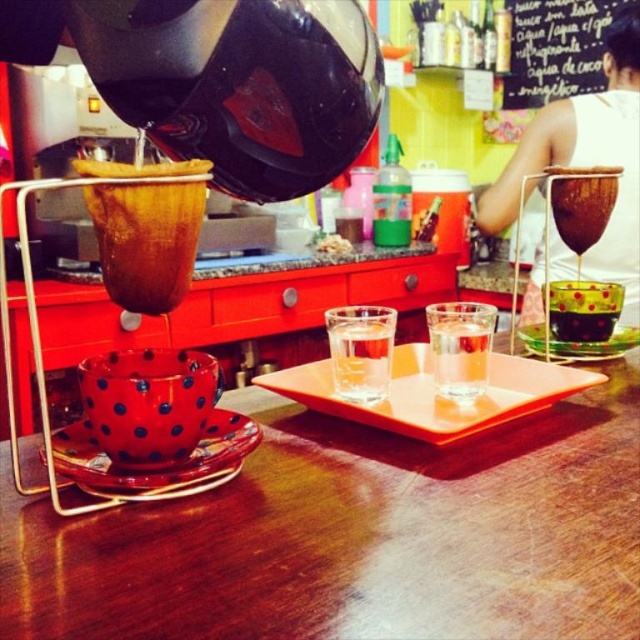
Can you confirm if wooden table at center is positioned above black chalkboard at upper center?

Incorrect, wooden table at center is not positioned above black chalkboard at upper center.

Is point (349, 451) closer to camera compared to point (593, 77)?

Yes, point (349, 451) is in front of point (593, 77).

This screenshot has height=640, width=640. What are the coordinates of `wooden table at center` in the screenshot? It's located at (355, 536).

Consider the image. Does wooden table at center lie behind clear glass water at center?

That is False.

Between wooden table at center and clear glass water at center, which one appears on the left side from the viewer's perspective?

Positioned to the left is clear glass water at center.

Between point (131, 513) and point (388, 324), which one is positioned in front?

Point (131, 513) is in front.

I want to click on wooden table at center, so click(355, 536).

Is polka dot glass at lower left bigger than polka dot glass at center?

No, polka dot glass at lower left is not bigger than polka dot glass at center.

Does polka dot glass at lower left lie in front of polka dot glass at center?

That is True.

Is point (97, 488) closer to viewer compared to point (611, 337)?

Yes.

Find the location of `polka dot glass at lower left`. polka dot glass at lower left is located at coordinates pyautogui.click(x=161, y=467).